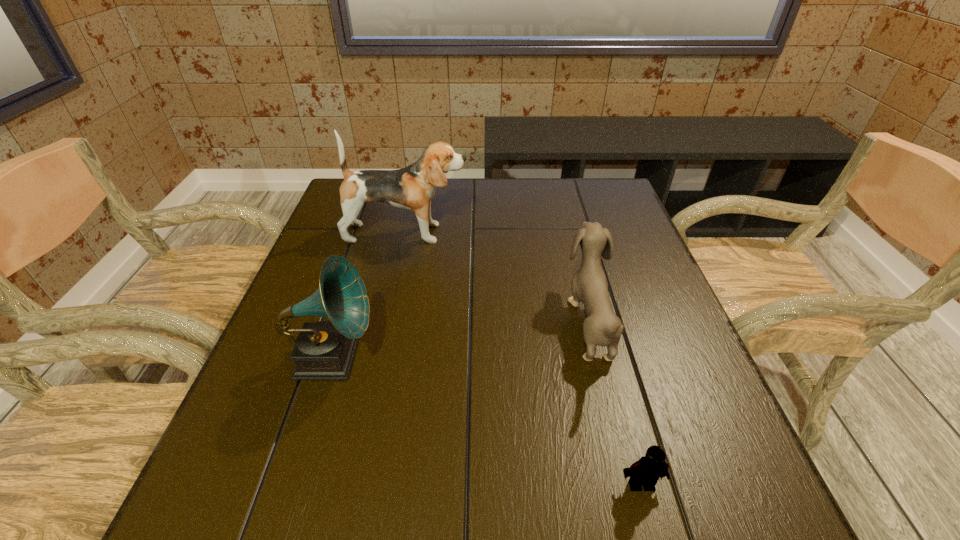
Locate an element on the screen. the farther puppy is located at coordinates (412, 188).

I want to click on the tallest object, so click(x=412, y=188).

Image resolution: width=960 pixels, height=540 pixels. Identify the location of phonograph_record. (324, 350).

Identify the location of the shorter puppy. (602, 327).

This screenshot has width=960, height=540. In order to click on the third tallest object in this screenshot , I will do `click(602, 327)`.

Locate an element on the screen. Lego is located at coordinates (646, 471).

Where is `the nearest object`? the nearest object is located at coordinates (646, 471).

Identify the location of vacant point located at the face of the farthest object. (538, 233).

Identify the location of free space located 0.270m from the horn of the phonograph_record. (512, 358).

Find the location of a particular element. vacant space located at the face of the nearer puppy is located at coordinates (x=494, y=322).